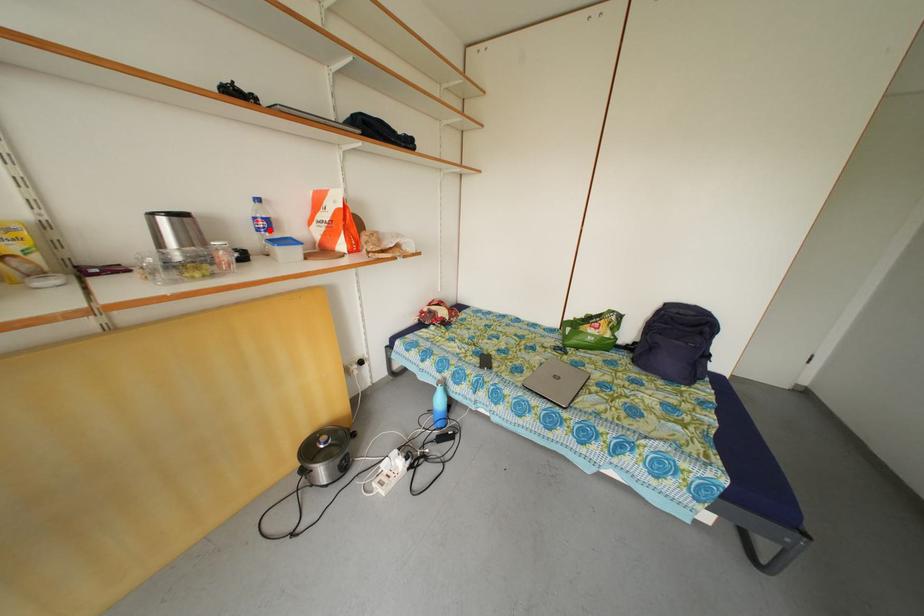
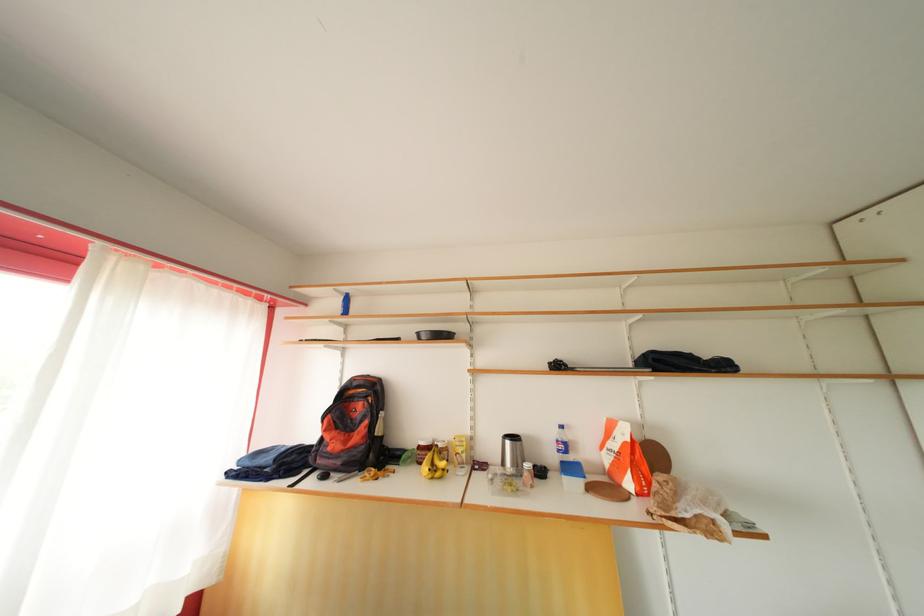
Question: I am providing you with two images of the same scene from different viewpoints. Given a red point in image1, look at the same physical point in image2. Is it:

Choices:
 (A) Closer to the viewpoint
 (B) Farther from the viewpoint

Answer: (B)